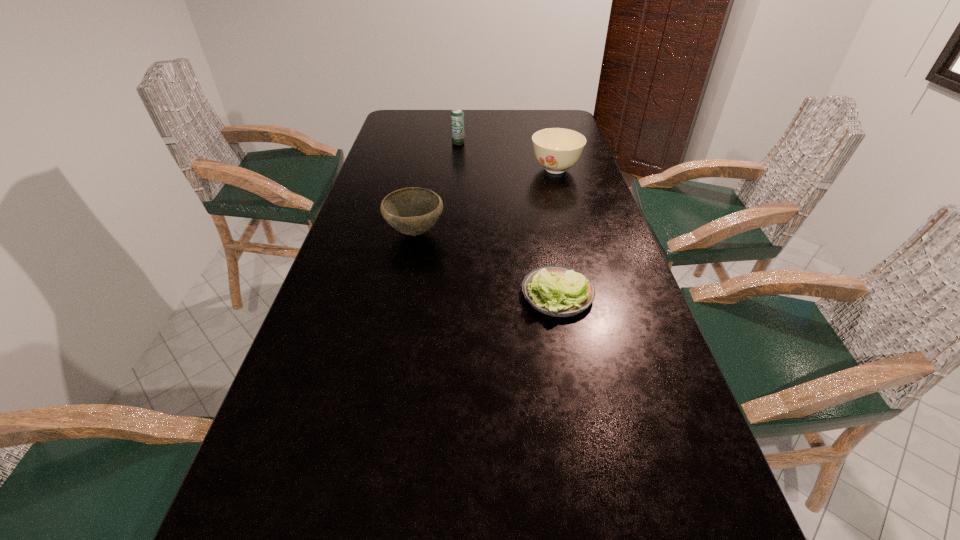
Identify the location of beer can. The image size is (960, 540). (457, 116).

What are the coordinates of `sugar bowl` in the screenshot? It's located at (556, 149).

Find the location of a particular element. This screenshot has width=960, height=540. the third farthest object is located at coordinates (412, 211).

I want to click on the nearest object, so click(x=558, y=291).

You are a GUI agent. You are given a task and a screenshot of the screen. Output one action in this format:
    pyautogui.click(x=<x>, y=<y>)
    Task: Click on the lettuce
    The image size is (960, 540).
    Given the screenshot: What is the action you would take?
    pyautogui.click(x=558, y=291)

Locate an element on the screen. free space located 0.320m on the right of the farthest object is located at coordinates (550, 143).

I want to click on vacant space located 0.210m on the left of the second farthest object, so click(x=468, y=170).

Where is `free spot located 0.150m on the back of the second nearest object`? The image size is (960, 540). free spot located 0.150m on the back of the second nearest object is located at coordinates (423, 190).

Identify the location of free space located on the left of the shortest object. The width and height of the screenshot is (960, 540). (483, 294).

In order to click on object at the left edge in this screenshot , I will do `click(412, 211)`.